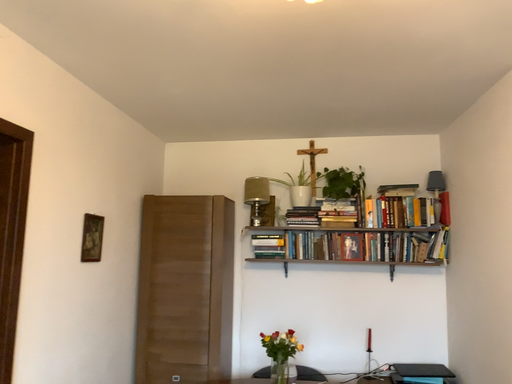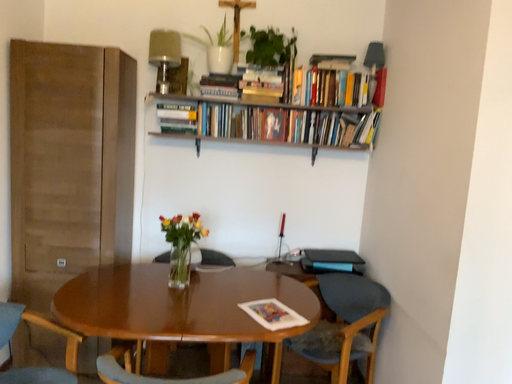
Question: How did the camera likely rotate when shooting the video?

Choices:
 (A) rotated left
 (B) rotated right

Answer: (B)